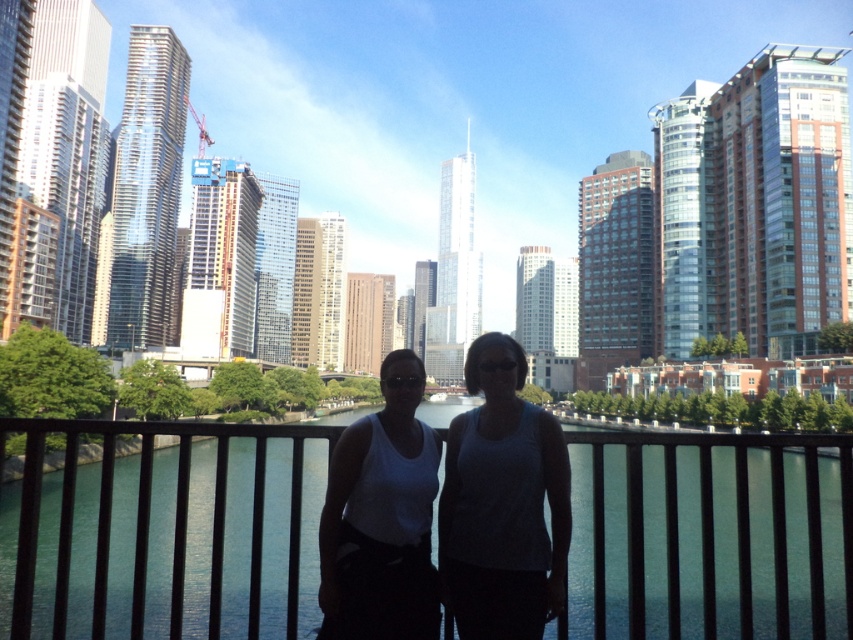
You are observing two white tank tops in the image. The first is a white fabric tank top at center, and the second is a white matte tank top at center. Which one is positioned higher in the scene?

The white fabric tank top at center is positioned higher than the white matte tank top at center.

Consider the image. You are a photographer standing at the edge of a black metal fence at center in an urban area. You want to take a photo of a cityscape with a camera that has a maximum range of 35 meters. Will the camera be able to capture the cityscape clearly from your current position?

The black metal fence at center and the camera are 36.37 meters apart. Since the camera has a maximum range of 35 meters, it cannot capture the cityscape clearly from the current position as the distance exceeds its range.